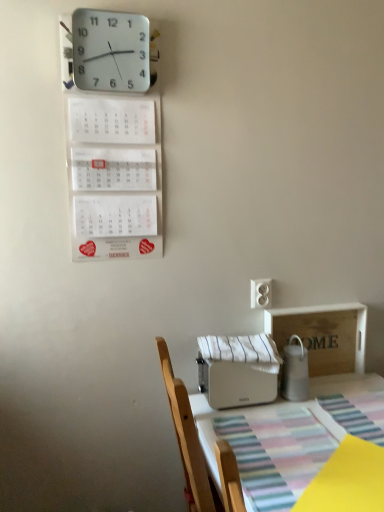
Question: Is white plastic toaster at lower center inside or outside of white striped fabric at center?

Choices:
 (A) inside
 (B) outside

Answer: (B)

Question: In the image, is white plastic toaster at lower center positioned in front of or behind white striped fabric at center?

Choices:
 (A) behind
 (B) front

Answer: (B)

Question: Which object is the closest to the white plastic toaster at lower center?

Choices:
 (A) white plastic toaster at lower center, positioned as the first appliance in left-to-right order
 (B) white paper calendar at upper left
 (C) white striped fabric at center
 (D) white plastic wall clock at upper left
 (E) white glossy milk jug at right, placed as the 2th appliance when sorted from left to right

Answer: (A)

Question: Which object is the closest to the white plastic toaster at lower center, the second appliance from the right?

Choices:
 (A) white striped fabric at center
 (B) white plastic toaster at lower center
 (C) white plastic electric outlet at center-right
 (D) white paper calendar at upper left
 (E) white glossy milk jug at right, acting as the 1th appliance starting from the right

Answer: (A)